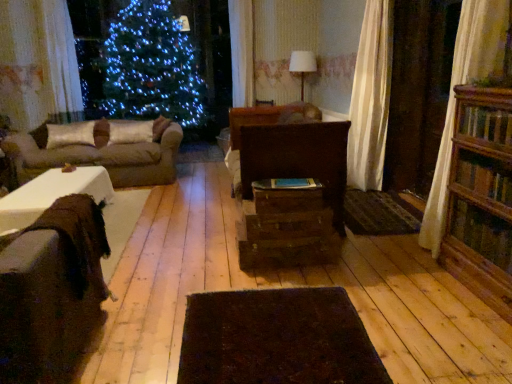
Question: Does wooden bookcase at right have a larger size compared to brown fabric couch at left, which appears as the 2th studio couch when viewed from the front?

Choices:
 (A) yes
 (B) no

Answer: (B)

Question: Can you confirm if wooden bookcase at right is taller than brown fabric couch at left, which appears as the 2th studio couch when viewed from the front?

Choices:
 (A) no
 (B) yes

Answer: (B)

Question: From the image's perspective, is wooden bookcase at right located above brown fabric couch at left, the second studio couch positioned from the bottom?

Choices:
 (A) yes
 (B) no

Answer: (B)

Question: Is wooden bookcase at right to the left of brown fabric couch at left, the first studio couch viewed from the top, from the viewer's perspective?

Choices:
 (A) yes
 (B) no

Answer: (B)

Question: Is brown fabric couch at left, the first studio couch viewed from the top, a part of wooden bookcase at right?

Choices:
 (A) yes
 (B) no

Answer: (B)

Question: Is wooden bookcase at right wider or thinner than silky gold pillow at left, acting as the 2th pillow starting from the right?

Choices:
 (A) wide
 (B) thin

Answer: (B)

Question: Relative to silky gold pillow at left, acting as the 2th pillow starting from the right, is wooden bookcase at right in front or behind?

Choices:
 (A) behind
 (B) front

Answer: (B)

Question: Is wooden bookcase at right spatially inside silky gold pillow at left, which ranks as the 1th pillow in left-to-right order, or outside of it?

Choices:
 (A) outside
 (B) inside

Answer: (A)

Question: From the image's perspective, is wooden bookcase at right positioned above or below silky gold pillow at left, which ranks as the 1th pillow in left-to-right order?

Choices:
 (A) above
 (B) below

Answer: (B)

Question: From the image's perspective, relative to wooden drawer at center, which ranks as the 1th drawer in bottom-to-top order, is silky beige pillow at center, the first pillow from the right, above or below?

Choices:
 (A) above
 (B) below

Answer: (A)

Question: Looking at their shapes, would you say silky beige pillow at center, arranged as the second pillow when viewed from the left, is wider or thinner than wooden drawer at center, which ranks as the 1th drawer in bottom-to-top order?

Choices:
 (A) thin
 (B) wide

Answer: (A)

Question: From a real-world perspective, is silky beige pillow at center, arranged as the second pillow when viewed from the left, physically located above or below wooden drawer at center, which ranks as the 1th drawer in bottom-to-top order?

Choices:
 (A) below
 (B) above

Answer: (B)

Question: Visually, is silky beige pillow at center, the first pillow from the right, positioned to the left or to the right of wooden drawer at center, placed as the 2th drawer when sorted from top to bottom?

Choices:
 (A) right
 (B) left

Answer: (B)

Question: In the image, is wooden bookcase at right positioned in front of or behind dark brown textured mat at center?

Choices:
 (A) behind
 (B) front

Answer: (B)

Question: Is wooden bookcase at right to the left or to the right of dark brown textured mat at center in the image?

Choices:
 (A) right
 (B) left

Answer: (A)